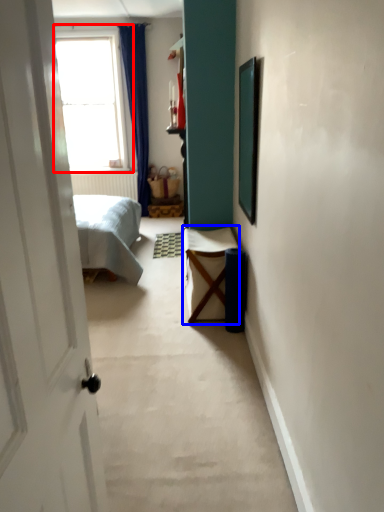
Question: Which of the following is the farthest to the observer, window (highlighted by a red box) or furniture (highlighted by a blue box)?

Choices:
 (A) window
 (B) furniture

Answer: (A)